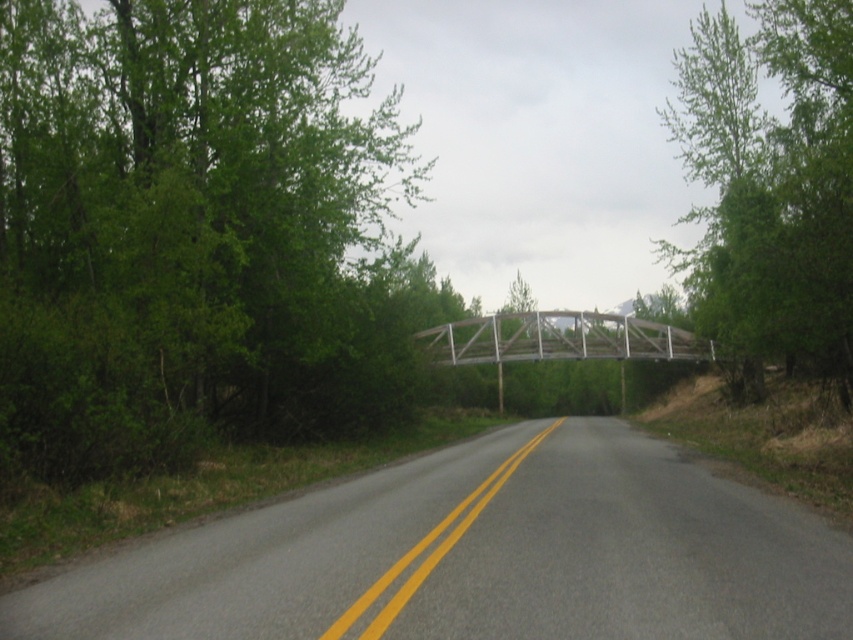
Question: Does green leafy tree at left have a greater width compared to green leafy tree at right?

Choices:
 (A) no
 (B) yes

Answer: (A)

Question: Which of these objects is positioned closest to the green leafy tree at right?

Choices:
 (A) green leafy tree at left
 (B) asphalt road at center

Answer: (A)

Question: Is asphalt road at center thinner than green leafy tree at right?

Choices:
 (A) yes
 (B) no

Answer: (A)

Question: Based on their relative distances, which object is nearer to the asphalt road at center?

Choices:
 (A) green leafy tree at right
 (B) green leafy tree at left

Answer: (B)

Question: Which object is closer to the camera taking this photo?

Choices:
 (A) green leafy tree at right
 (B) asphalt road at center

Answer: (B)

Question: Is asphalt road at center positioned behind green leafy tree at right?

Choices:
 (A) no
 (B) yes

Answer: (A)